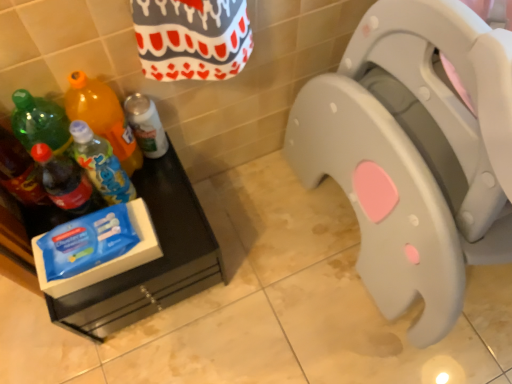
Question: Is translucent plastic soda bottle at left, which appears as the 5th bottle when viewed from the right, bigger than gray plastic toilet seat at center?

Choices:
 (A) no
 (B) yes

Answer: (A)

Question: Is translucent plastic soda bottle at left, which appears as the 5th bottle when viewed from the right, smaller than gray plastic toilet seat at center?

Choices:
 (A) no
 (B) yes

Answer: (B)

Question: Is translucent plastic soda bottle at left, which appears as the 5th bottle when viewed from the right, outside of gray plastic toilet seat at center?

Choices:
 (A) no
 (B) yes

Answer: (B)

Question: Is translucent plastic soda bottle at left, which appears as the 5th bottle when viewed from the right, looking in the opposite direction of gray plastic toilet seat at center?

Choices:
 (A) no
 (B) yes

Answer: (A)

Question: Does translucent plastic soda bottle at left, which is counted as the first bottle, starting from the left, have a lesser height compared to gray plastic toilet seat at center?

Choices:
 (A) no
 (B) yes

Answer: (B)

Question: In the image, is translucent plastic soda bottle at left, the fourth bottle when ordered from right to left, positioned in front of or behind blue plastic bottle at left, arranged as the fourth bottle when viewed from the left?

Choices:
 (A) front
 (B) behind

Answer: (A)

Question: From a real-world perspective, is translucent plastic soda bottle at left, the fourth bottle when ordered from right to left, above or below blue plastic bottle at left, placed as the second bottle when sorted from right to left?

Choices:
 (A) below
 (B) above

Answer: (B)

Question: Is translucent plastic soda bottle at left, which is the second bottle from left to right, to the left or to the right of blue plastic bottle at left, placed as the second bottle when sorted from right to left, in the image?

Choices:
 (A) right
 (B) left

Answer: (B)

Question: From the image's perspective, is translucent plastic soda bottle at left, the fourth bottle when ordered from right to left, positioned above or below blue plastic bottle at left, placed as the second bottle when sorted from right to left?

Choices:
 (A) below
 (B) above

Answer: (A)

Question: Considering the positions of point (134, 117) and point (76, 104), is point (134, 117) closer or farther from the camera than point (76, 104)?

Choices:
 (A) closer
 (B) farther

Answer: (B)

Question: From the image's perspective, is white matte spray can at lower left, the first bottle positioned from the right, positioned above or below translucent plastic bottle at left, which is the third bottle from left to right?

Choices:
 (A) below
 (B) above

Answer: (B)

Question: Considering the relative positions of white matte spray can at lower left, the first bottle positioned from the right, and translucent plastic bottle at left, which is the third bottle from left to right, in the image provided, is white matte spray can at lower left, the first bottle positioned from the right, to the left or to the right of translucent plastic bottle at left, which is the third bottle from left to right,?

Choices:
 (A) right
 (B) left

Answer: (A)

Question: Is white matte spray can at lower left, which ranks as the 5th bottle in left-to-right order, wider or thinner than translucent plastic bottle at left, which is the third bottle from left to right?

Choices:
 (A) thin
 (B) wide

Answer: (A)

Question: Is translucent plastic soda bottle at left, which is the second bottle from left to right, in front of or behind gray plastic toilet seat at center in the image?

Choices:
 (A) front
 (B) behind

Answer: (B)

Question: Is translucent plastic soda bottle at left, which is the second bottle from left to right, inside the boundaries of gray plastic toilet seat at center, or outside?

Choices:
 (A) inside
 (B) outside

Answer: (B)